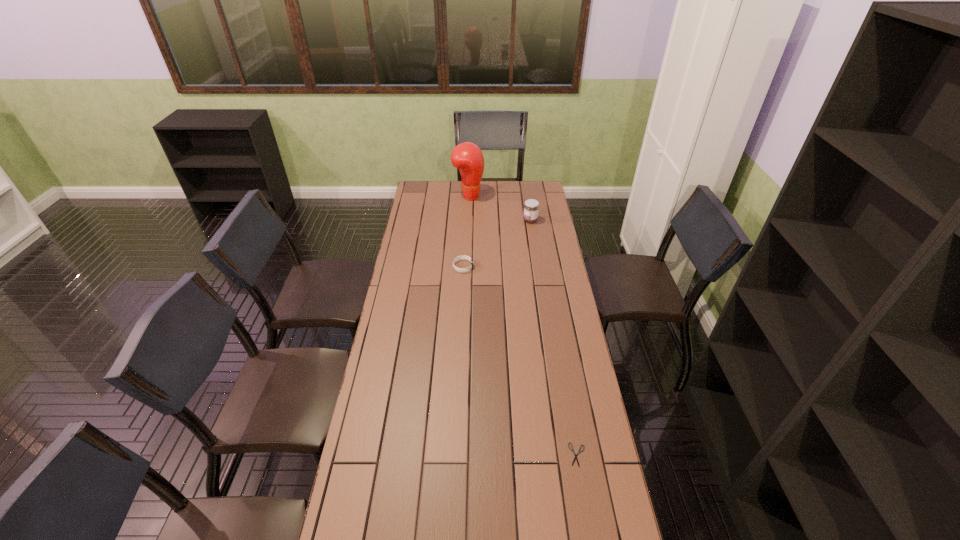
At what (x,y) coordinates should I click in order to perform the action: click on vacant space located on the front label of the third shortest object. Please return your answer as a coordinate pair (x, y). The width and height of the screenshot is (960, 540). Looking at the image, I should click on (471, 220).

Locate an element on the screen. vacant space located 0.070m on the front label of the third shortest object is located at coordinates (510, 220).

Identify the location of blank space located on the outer surface of the third tallest object. Image resolution: width=960 pixels, height=540 pixels. (532, 267).

Image resolution: width=960 pixels, height=540 pixels. Identify the location of vacant space located 0.110m on the back of the shears. (570, 411).

Where is `object at the far edge`? object at the far edge is located at coordinates (467, 157).

This screenshot has height=540, width=960. In order to click on jam that is at the right edge in this screenshot , I will do `click(531, 207)`.

You are a GUI agent. You are given a task and a screenshot of the screen. Output one action in this format:
    pyautogui.click(x=<x>, y=<y>)
    Task: Click on the shears that is at the right edge
    The image size is (960, 540).
    Given the screenshot: What is the action you would take?
    (572, 450)

Where is `vacant space at the far edge`? This screenshot has height=540, width=960. vacant space at the far edge is located at coordinates (490, 194).

This screenshot has height=540, width=960. Find the location of `free point at the left edge`. free point at the left edge is located at coordinates (404, 255).

What are the coordinates of `free region at the right edge of the desktop` in the screenshot? It's located at (560, 442).